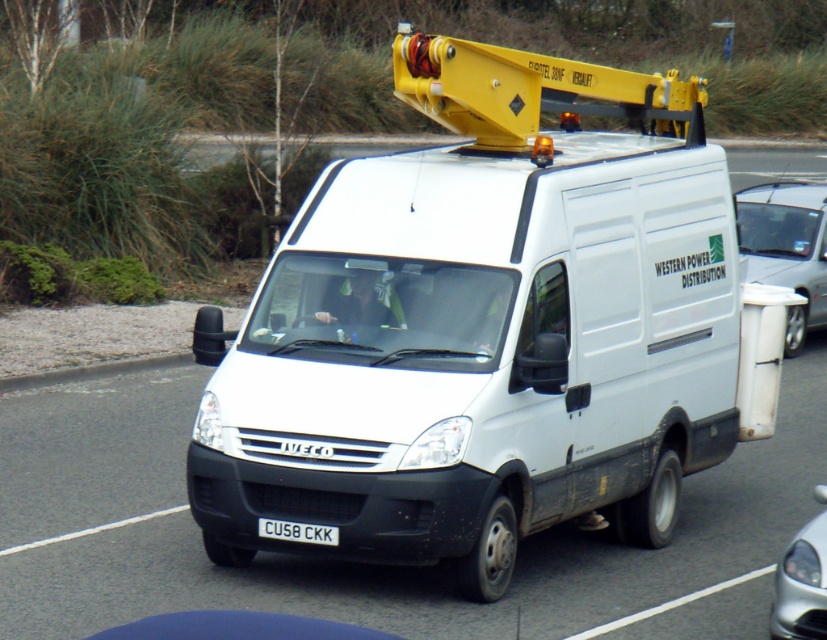
You are a delivery person who needs to park your white matte van at center in a parking spot located behind the white plastic trash can at right. Is the van currently positioned in the correct spot?

The white matte van at center is positioned under the white plastic trash can at right, so it is not in the correct parking spot behind the trash can. Move the van to the rear of the trash can to park correctly.

You are standing next to a camera and want to take a photo of the white matte van at center. The camera requires the subject to be at least 10 meters away to avoid distortion. Based on the scene description, will the van be too close for the camera to capture without distortion?

The white matte van at center and camera are 9.72 meters apart, which is less than the required 10 meters. Therefore, the van is too close for the camera to capture without distortion.